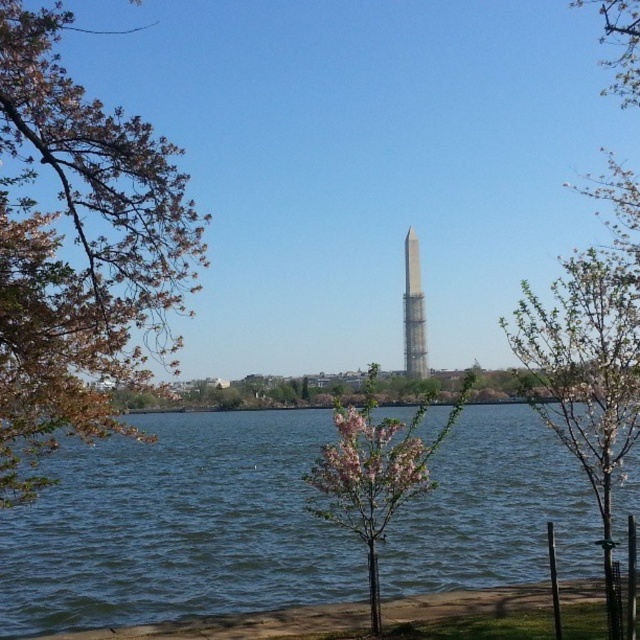
Question: Which object is closer to the camera taking this photo?

Choices:
 (A) blue water at center
 (B) pink blossoming tree at center

Answer: (B)

Question: Does blue water at center have a lesser width compared to pink blossoming tree at center?

Choices:
 (A) yes
 (B) no

Answer: (B)

Question: Considering the real-world distances, which object is closest to the silver metallic tower at center?

Choices:
 (A) white blossoming tree at center
 (B) pink blossoming tree at center
 (C) blue water at center

Answer: (C)

Question: Does brown leafy tree at left have a lesser width compared to silver metallic tower at center?

Choices:
 (A) yes
 (B) no

Answer: (B)

Question: Is pink blossoming tree at center below silver metallic tower at center?

Choices:
 (A) no
 (B) yes

Answer: (B)

Question: Which of the following is the closest to the observer?

Choices:
 (A) pink blossoming tree at center
 (B) silver metallic tower at center
 (C) blue water at center

Answer: (A)